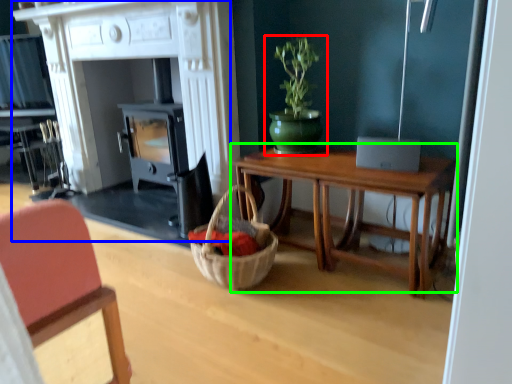
Question: Estimate the real-world distances between objects in this image. Which object is farther from houseplant (highlighted by a red box), fireplace (highlighted by a blue box) or table (highlighted by a green box)?

Choices:
 (A) fireplace
 (B) table

Answer: (A)